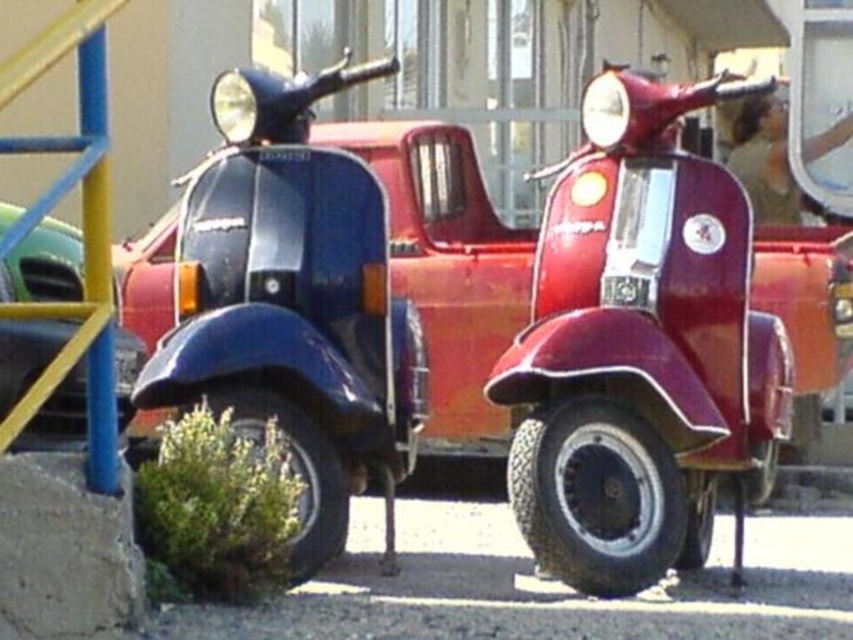
Question: Can you confirm if shiny red pickup truck at center is positioned below glossy blue scooter at center?

Choices:
 (A) yes
 (B) no

Answer: (A)

Question: Which object appears farthest from the camera in this image?

Choices:
 (A) glossy blue scooter at center
 (B) shiny red pickup truck at center

Answer: (A)

Question: Which of these objects is positioned farthest from the green matte car at left?

Choices:
 (A) shiny red pickup truck at center
 (B) glossy blue scooter at center

Answer: (B)

Question: Is shiny red pickup truck at center further to camera compared to green matte car at left?

Choices:
 (A) no
 (B) yes

Answer: (B)

Question: Does shiny red pickup truck at center have a smaller size compared to glossy blue scooter at center?

Choices:
 (A) no
 (B) yes

Answer: (B)

Question: Which object appears closest to the camera in this image?

Choices:
 (A) shiny red pickup truck at center
 (B) green matte car at left

Answer: (B)